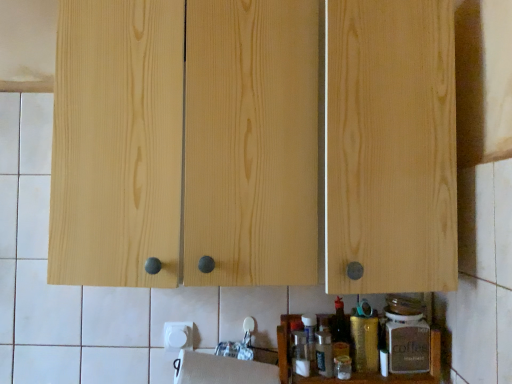
Question: Considering the relative sizes of wooden spice rack at lower center and white matte paper towel at lower center in the image provided, is wooden spice rack at lower center taller than white matte paper towel at lower center?

Choices:
 (A) yes
 (B) no

Answer: (A)

Question: Would you say wooden spice rack at lower center contains white matte paper towel at lower center?

Choices:
 (A) yes
 (B) no

Answer: (B)

Question: Is wooden spice rack at lower center completely or partially outside of white matte paper towel at lower center?

Choices:
 (A) yes
 (B) no

Answer: (A)

Question: Does wooden spice rack at lower center come behind white matte paper towel at lower center?

Choices:
 (A) yes
 (B) no

Answer: (B)

Question: Considering the relative positions of wooden spice rack at lower center and white matte paper towel at lower center in the image provided, is wooden spice rack at lower center to the left of white matte paper towel at lower center from the viewer's perspective?

Choices:
 (A) yes
 (B) no

Answer: (B)

Question: From a real-world perspective, is wooden spice rack at lower center located beneath white matte paper towel at lower center?

Choices:
 (A) yes
 (B) no

Answer: (A)

Question: Considering the relative sizes of white matte paper towel at lower center and wooden spice rack at lower center in the image provided, is white matte paper towel at lower center shorter than wooden spice rack at lower center?

Choices:
 (A) no
 (B) yes

Answer: (B)

Question: Is white matte paper towel at lower center closer to the viewer compared to wooden spice rack at lower center?

Choices:
 (A) no
 (B) yes

Answer: (A)

Question: Does white matte paper towel at lower center appear on the left side of wooden spice rack at lower center?

Choices:
 (A) yes
 (B) no

Answer: (A)

Question: Could you tell me if white matte paper towel at lower center is facing wooden spice rack at lower center?

Choices:
 (A) yes
 (B) no

Answer: (B)

Question: Is white matte paper towel at lower center located outside wooden spice rack at lower center?

Choices:
 (A) yes
 (B) no

Answer: (A)

Question: Are white matte paper towel at lower center and wooden spice rack at lower center beside each other?

Choices:
 (A) yes
 (B) no

Answer: (B)

Question: Does wooden spice rack at lower center have a greater height compared to gold metallic canister at lower center, the 2th bottle viewed from the right?

Choices:
 (A) no
 (B) yes

Answer: (B)